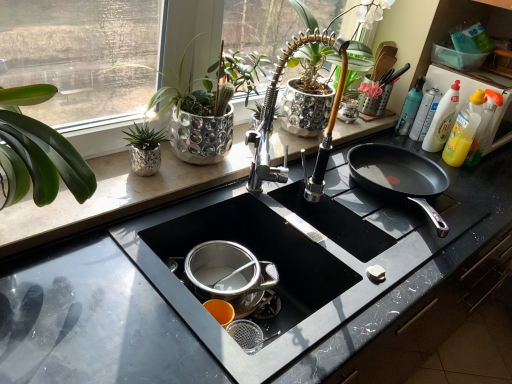
Question: Considering the relative positions of black granite countertop at center and green glossy plant at upper left, placed as the first houseplant when sorted from left to right, in the image provided, is black granite countertop at center in front of green glossy plant at upper left, placed as the first houseplant when sorted from left to right,?

Choices:
 (A) yes
 (B) no

Answer: (A)

Question: Does black granite countertop at center come behind green glossy plant at upper left, acting as the second houseplant starting from the right?

Choices:
 (A) yes
 (B) no

Answer: (B)

Question: From the image's perspective, is black granite countertop at center under green glossy plant at upper left, acting as the second houseplant starting from the right?

Choices:
 (A) yes
 (B) no

Answer: (B)

Question: Is black granite countertop at center not near green glossy plant at upper left, placed as the first houseplant when sorted from left to right?

Choices:
 (A) yes
 (B) no

Answer: (B)

Question: Does black granite countertop at center turn towards green glossy plant at upper left, acting as the second houseplant starting from the right?

Choices:
 (A) yes
 (B) no

Answer: (B)

Question: From the image's perspective, is black granite countertop at center located above green glossy plant at upper left, placed as the first houseplant when sorted from left to right?

Choices:
 (A) yes
 (B) no

Answer: (A)

Question: Considering the relative sizes of black marble countertop at center and black granite countertop at center in the image provided, is black marble countertop at center bigger than black granite countertop at center?

Choices:
 (A) yes
 (B) no

Answer: (A)

Question: Is black marble countertop at center at the left side of black granite countertop at center?

Choices:
 (A) yes
 (B) no

Answer: (B)

Question: Is black marble countertop at center oriented away from black granite countertop at center?

Choices:
 (A) no
 (B) yes

Answer: (B)

Question: From a real-world perspective, is black marble countertop at center physically below black granite countertop at center?

Choices:
 (A) no
 (B) yes

Answer: (B)

Question: Is black marble countertop at center thinner than black granite countertop at center?

Choices:
 (A) yes
 (B) no

Answer: (B)

Question: Considering the relative sizes of black marble countertop at center and black granite countertop at center in the image provided, is black marble countertop at center wider than black granite countertop at center?

Choices:
 (A) yes
 (B) no

Answer: (A)

Question: Is translucent plastic bottle at upper right at the right side of translucent plastic bottle at upper right?

Choices:
 (A) no
 (B) yes

Answer: (B)